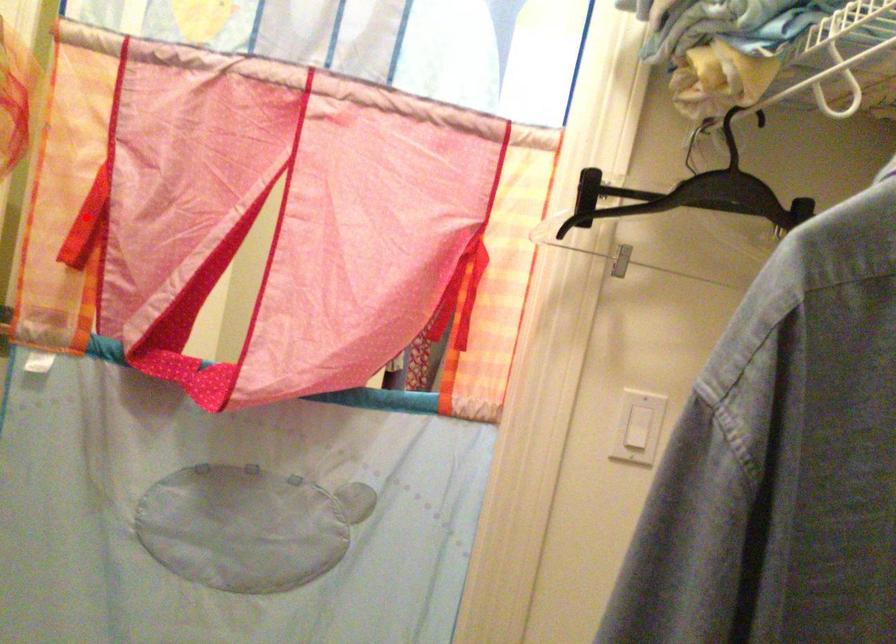
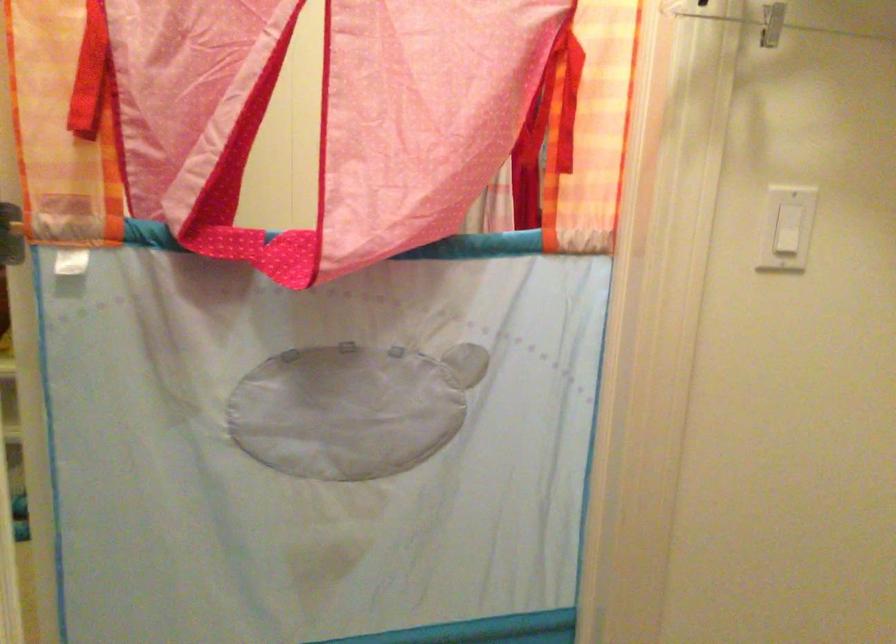
Locate, in the second image, the point that corresponds to the highlighted location in the first image.

(90, 73)